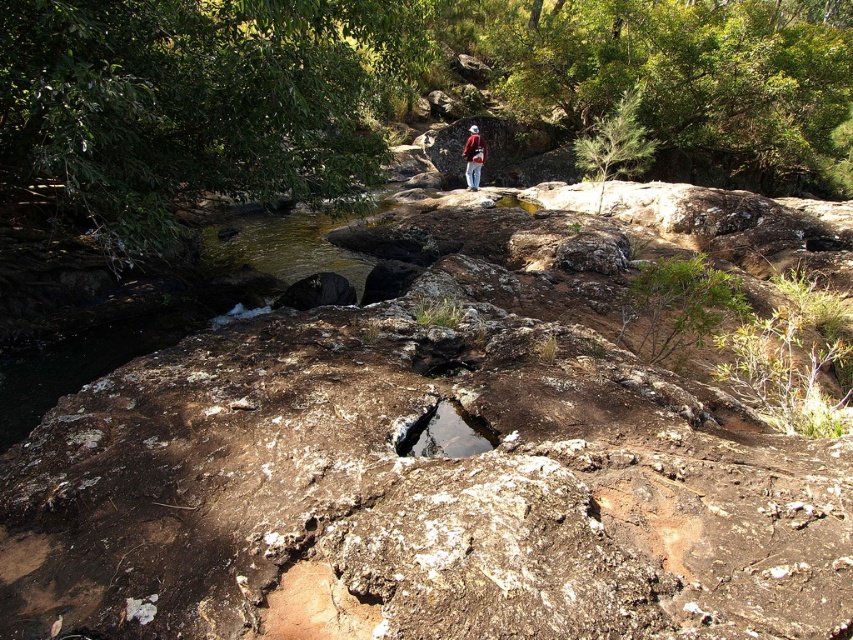
You are a hiker trying to cross the stream. There is a brown rock at center and a red woolen jacket at center in your path. Which object is taller and could potentially block your path?

The brown rock at center is much taller than the red woolen jacket at center, so it is the object that could potentially block your path.

You are navigating a rocky terrain and need to locate the brown rough rock at center. Based on the coordinates provided, where would you find it in the image?

The brown rough rock at center is located at the 2D coordinates point (444,458) in the image.